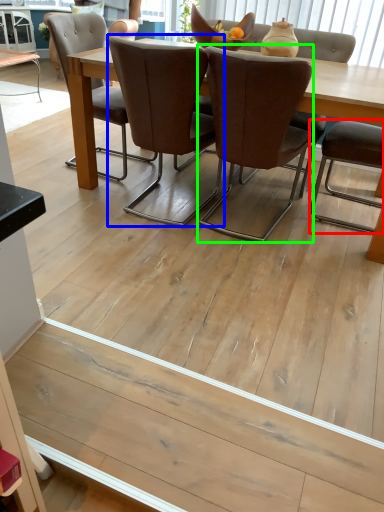
Question: Considering the real-world distances, which object is farthest from chair (highlighted by a red box)? chair (highlighted by a blue box) or chair (highlighted by a green box)?

Choices:
 (A) chair
 (B) chair

Answer: (A)